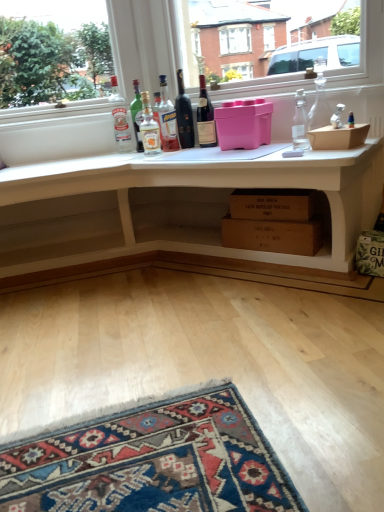
You are a GUI agent. You are given a task and a screenshot of the screen. Output one action in this format:
    pyautogui.click(x=<x>, y=<y>)
    Task: Click on the empty space that is in between pink plastic container at center, which ranks as the 1th box in top-to-bottom order, and clear glass decanter at upper right, which is counted as the seventh bottle, starting from the left
    This screenshot has width=384, height=512.
    Given the screenshot: What is the action you would take?
    pyautogui.click(x=283, y=145)